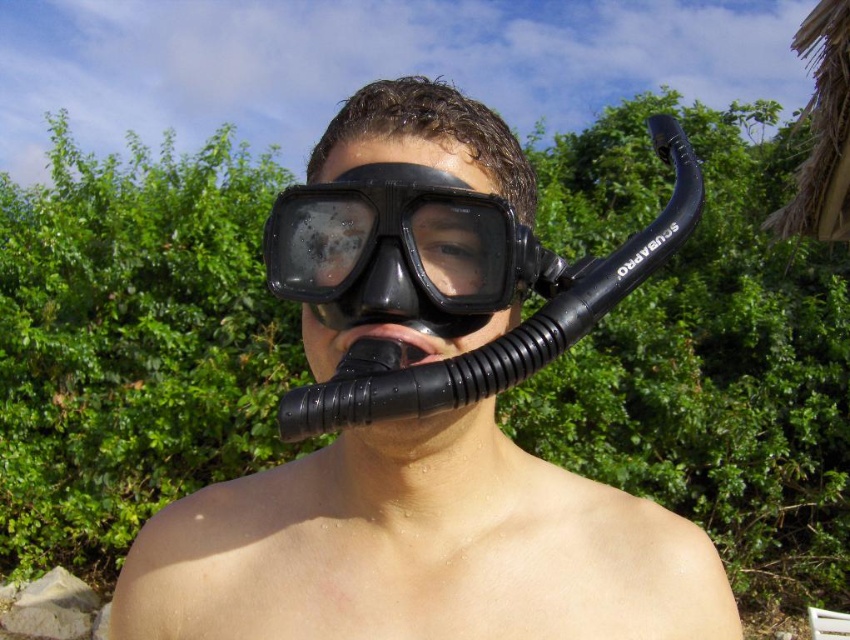
Can you confirm if black matte snorkel at center is positioned above black rubber snorkel at center?

Incorrect, black matte snorkel at center is not positioned above black rubber snorkel at center.

Can you confirm if black matte snorkel at center is bigger than black rubber snorkel at center?

Yes.

Between point (612, 540) and point (281, 280), which one is positioned in front?

Positioned in front is point (281, 280).

At what (x,y) coordinates should I click in order to perform the action: click on black matte snorkel at center. Please return your answer as a coordinate pair (x, y). This screenshot has width=850, height=640. Looking at the image, I should click on click(x=421, y=550).

Is black rubber snorkel at center smaller than black matte snorkel mask at center?

No, black rubber snorkel at center is not smaller than black matte snorkel mask at center.

This screenshot has height=640, width=850. Describe the element at coordinates (452, 284) in the screenshot. I see `black rubber snorkel at center` at that location.

I want to click on black rubber snorkel at center, so click(452, 284).

Is black matte snorkel at center to the left of black matte snorkel mask at center from the viewer's perspective?

No, black matte snorkel at center is not to the left of black matte snorkel mask at center.

Who is more forward, (256,621) or (309,298)?

Point (309,298) is more forward.

The image size is (850, 640). Identify the location of black matte snorkel at center. (421, 550).